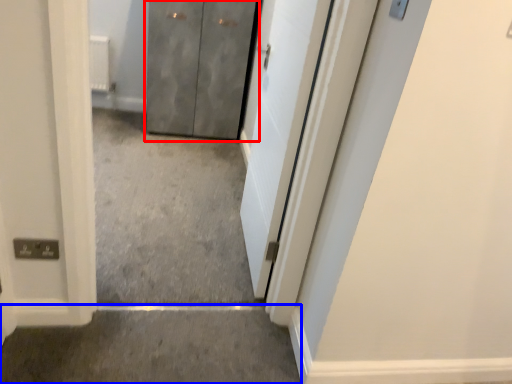
Question: Among these objects, which one is nearest to the camera, door (highlighted by a red box) or concrete (highlighted by a blue box)?

Choices:
 (A) door
 (B) concrete

Answer: (B)